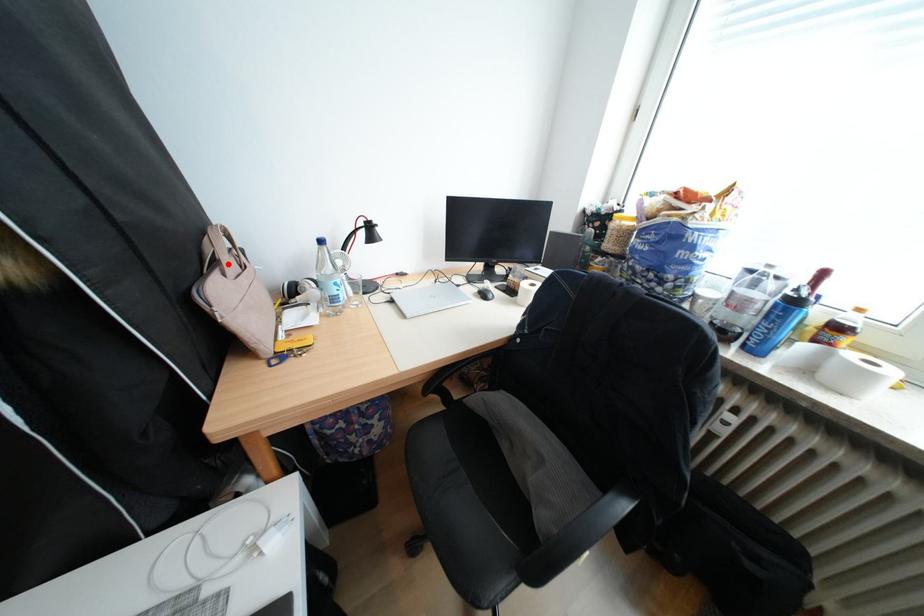
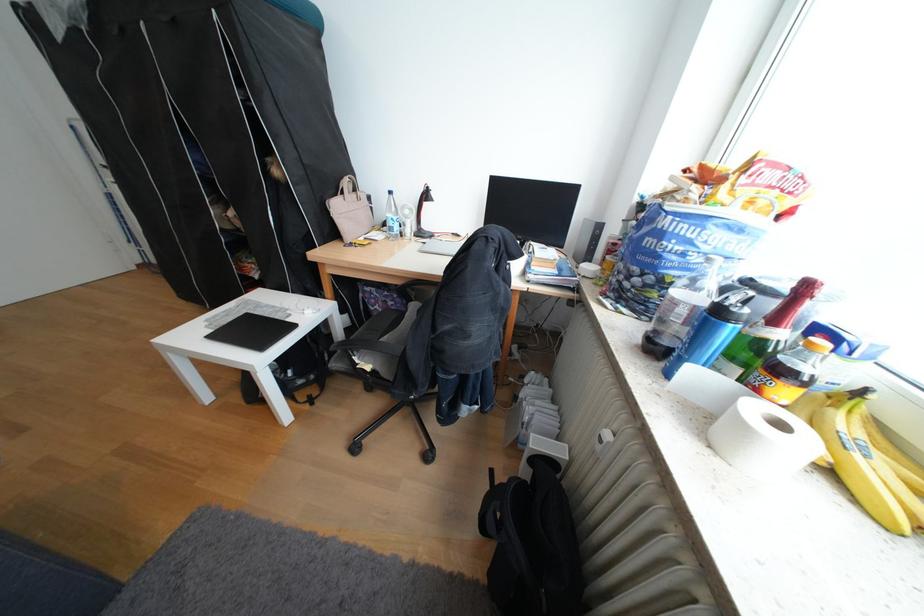
Question: I am providing you with two images of the same scene from different viewpoints. In image1, a red point is highlighted. Considering the same 3D point in image2, which of the following is correct?

Choices:
 (A) It is closer
 (B) It is farther

Answer: (A)